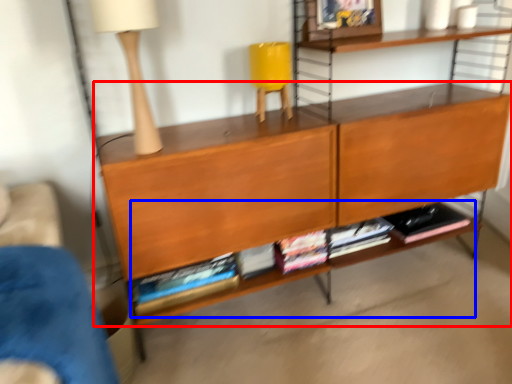
Question: Among these objects, which one is nearest to the camera, shelf (highlighted by a red box) or book (highlighted by a blue box)?

Choices:
 (A) shelf
 (B) book

Answer: (A)